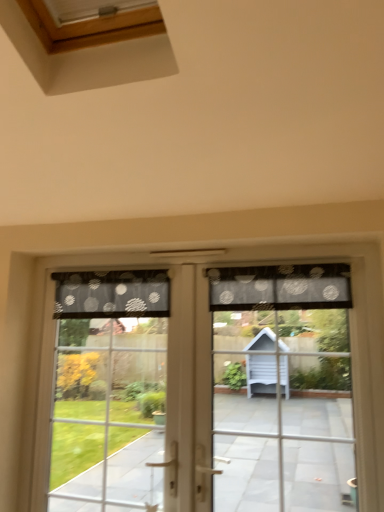
Question: Does translucent polka dot curtain at center come behind black dotted fabric at upper center, the second curtain when ordered from right to left?

Choices:
 (A) no
 (B) yes

Answer: (A)

Question: Is translucent polka dot curtain at center facing away from black dotted fabric at upper center, acting as the first curtain starting from the left?

Choices:
 (A) no
 (B) yes

Answer: (A)

Question: Can you confirm if translucent polka dot curtain at center is bigger than black dotted fabric at upper center, acting as the first curtain starting from the left?

Choices:
 (A) no
 (B) yes

Answer: (B)

Question: Considering the relative positions of translucent polka dot curtain at center and black dotted fabric at upper center, acting as the first curtain starting from the left, in the image provided, is translucent polka dot curtain at center in front of black dotted fabric at upper center, acting as the first curtain starting from the left,?

Choices:
 (A) yes
 (B) no

Answer: (A)

Question: Is translucent polka dot curtain at center outside black dotted fabric at upper center, the second curtain when ordered from right to left?

Choices:
 (A) no
 (B) yes

Answer: (B)

Question: Considering the relative positions of black dotted fabric at upper center, the first curtain when ordered from right to left, and translucent polka dot curtain at center in the image provided, is black dotted fabric at upper center, the first curtain when ordered from right to left, to the left or to the right of translucent polka dot curtain at center?

Choices:
 (A) right
 (B) left

Answer: (A)

Question: From the image's perspective, is black dotted fabric at upper center, the first curtain when ordered from right to left, positioned above or below translucent polka dot curtain at center?

Choices:
 (A) below
 (B) above

Answer: (B)

Question: From their relative heights in the image, would you say black dotted fabric at upper center, the first curtain when ordered from right to left, is taller or shorter than translucent polka dot curtain at center?

Choices:
 (A) tall
 (B) short

Answer: (B)

Question: Is point (302, 282) closer or farther from the camera than point (347, 296)?

Choices:
 (A) farther
 (B) closer

Answer: (A)

Question: Relative to translucent polka dot curtain at center, is black dotted fabric at upper center, the second curtain when ordered from right to left, in front or behind?

Choices:
 (A) behind
 (B) front

Answer: (A)

Question: From the image's perspective, is black dotted fabric at upper center, the second curtain when ordered from right to left, above or below translucent polka dot curtain at center?

Choices:
 (A) below
 (B) above

Answer: (B)

Question: From a real-world perspective, is black dotted fabric at upper center, the second curtain when ordered from right to left, above or below translucent polka dot curtain at center?

Choices:
 (A) below
 (B) above

Answer: (B)

Question: Considering the positions of black dotted fabric at upper center, acting as the first curtain starting from the left, and translucent polka dot curtain at center in the image, is black dotted fabric at upper center, acting as the first curtain starting from the left, taller or shorter than translucent polka dot curtain at center?

Choices:
 (A) short
 (B) tall

Answer: (A)

Question: From the image's perspective, is translucent polka dot curtain at center positioned above or below transparent fabric at center?

Choices:
 (A) above
 (B) below

Answer: (A)

Question: From a real-world perspective, is translucent polka dot curtain at center physically located above or below transparent fabric at center?

Choices:
 (A) above
 (B) below

Answer: (B)